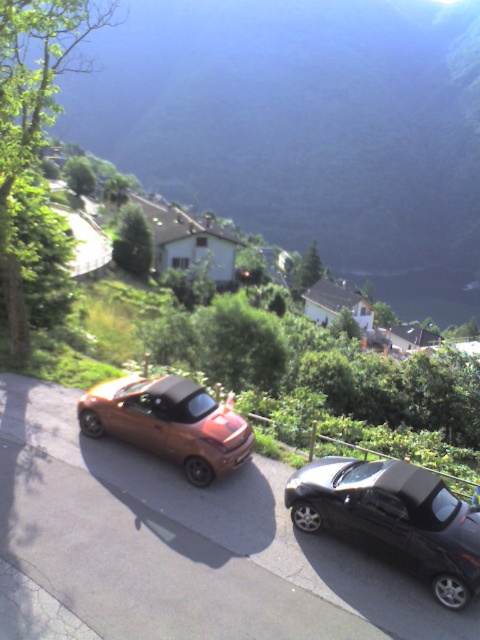
Is metallic orange car at center to the left of shiny black sedan at lower right from the viewer's perspective?

Correct, you'll find metallic orange car at center to the left of shiny black sedan at lower right.

Which is more to the left, metallic orange car at center or shiny black sedan at lower right?

metallic orange car at center is more to the left.

Is point (244, 493) less distant than point (432, 545)?

No, (244, 493) is behind (432, 545).

Identify the location of metallic orange car at center. The height and width of the screenshot is (640, 480). (163, 544).

Looking at this image, can you confirm if metallic orange car at center is positioned above matte orange car at center?

No.

Between metallic orange car at center and matte orange car at center, which one is positioned higher?

matte orange car at center is above.

The width and height of the screenshot is (480, 640). What do you see at coordinates (163, 544) in the screenshot? I see `metallic orange car at center` at bounding box center [163, 544].

Locate an element on the screen. metallic orange car at center is located at coordinates (163, 544).

Which is in front, point (337, 509) or point (107, 412)?

Point (337, 509) is in front.

Is shiny black sedan at lower right thinner than matte orange car at center?

Correct, shiny black sedan at lower right's width is less than matte orange car at center's.

Image resolution: width=480 pixels, height=640 pixels. I want to click on shiny black sedan at lower right, so click(x=394, y=516).